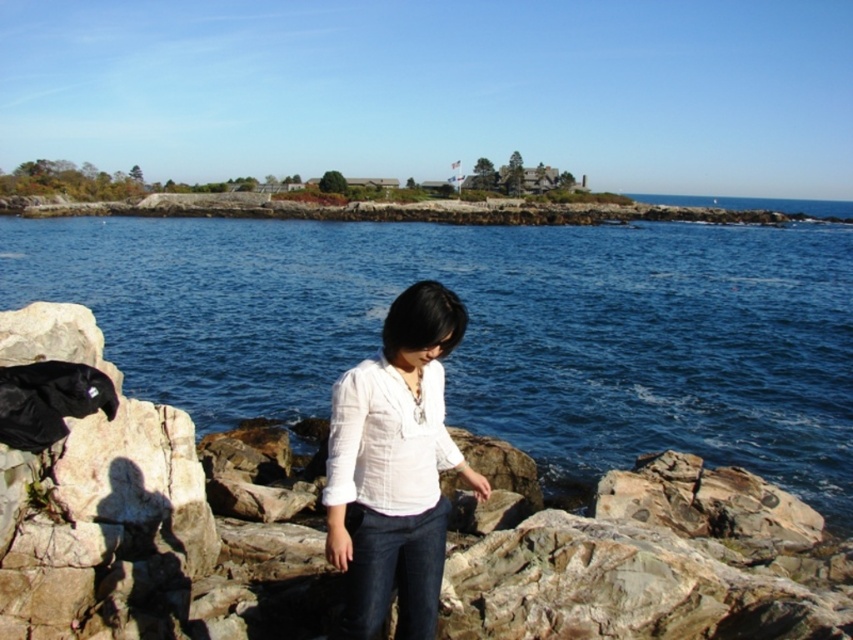
You are a photographer trying to capture the blue liquid water at center and the white cotton blouse at center in a single frame. Which object should you focus on first to ensure both are in the frame without needing to adjust the camera angle?

The blue liquid water at center has a larger size compared to the white cotton blouse at center, so you should focus on the blue liquid water at center first to ensure it fits within the frame while also accommodating the smaller white cotton blouse at center.

You are standing at the rocky shoreline and want to take a photo of both the point at coordinates (x=194, y=339) and the point at coordinates (x=397, y=577). Which point should you focus on first to ensure both are in focus?

You should focus on the point at coordinates (x=194, y=339) first because it is closer to the camera than the point at coordinates (x=397, y=577). This ensures the closer point is in focus, and the farther point will also be within the depth of field.